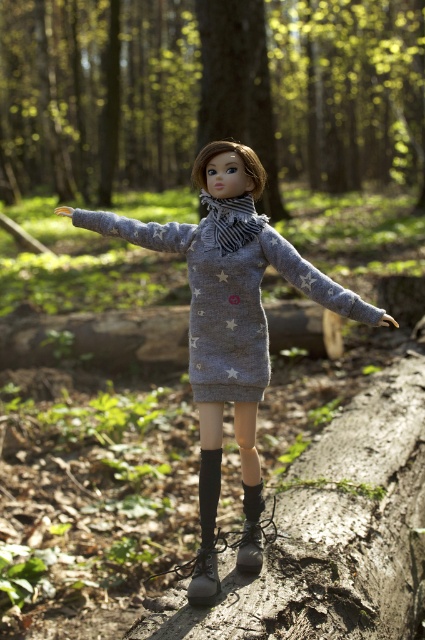
Does smooth bark log at center lie in front of gray knit dress at center?

No, it is not.

Consider the image. Can you confirm if smooth bark log at center is positioned above gray knit dress at center?

Yes.

Between point (336, 166) and point (272, 243), which one is positioned in front?

Point (272, 243) is in front.

This screenshot has width=425, height=640. I want to click on smooth bark log at center, so click(348, 90).

Between gray matte dress at center and striped knit scarf at center, which one has more height?

With more height is gray matte dress at center.

Is point (306, 282) positioned after point (235, 221)?

No, (306, 282) is closer to viewer.

The width and height of the screenshot is (425, 640). I want to click on gray matte dress at center, so click(x=231, y=316).

Who is shorter, gray matte dress at center or gray knit dress at center?

gray knit dress at center is shorter.

Is gray matte dress at center to the left of gray knit dress at center from the viewer's perspective?

In fact, gray matte dress at center is to the right of gray knit dress at center.

Which is in front, point (220, 189) or point (169, 234)?

Point (220, 189) is in front.

Where is `gray matte dress at center`? This screenshot has height=640, width=425. gray matte dress at center is located at coordinates (231, 316).